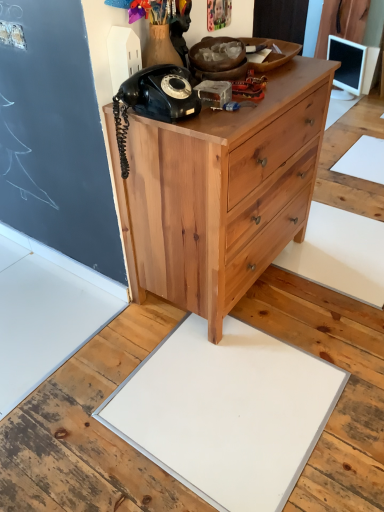
Question: Can you confirm if white glossy monitor at upper right is wider than natural wood chest of drawers at center?

Choices:
 (A) no
 (B) yes

Answer: (A)

Question: Could you tell me if white glossy monitor at upper right is facing natural wood chest of drawers at center?

Choices:
 (A) yes
 (B) no

Answer: (B)

Question: Can you confirm if white glossy monitor at upper right is shorter than natural wood chest of drawers at center?

Choices:
 (A) no
 (B) yes

Answer: (B)

Question: Is white glossy monitor at upper right far away from natural wood chest of drawers at center?

Choices:
 (A) no
 (B) yes

Answer: (B)

Question: Is white glossy monitor at upper right at the left side of natural wood chest of drawers at center?

Choices:
 (A) no
 (B) yes

Answer: (A)

Question: Is white glossy monitor at upper right located outside natural wood chest of drawers at center?

Choices:
 (A) yes
 (B) no

Answer: (A)

Question: Is white matte slate at center closer to camera compared to white glossy monitor at upper right?

Choices:
 (A) yes
 (B) no

Answer: (A)

Question: Is white matte slate at center facing away from white glossy monitor at upper right?

Choices:
 (A) yes
 (B) no

Answer: (B)

Question: Can you confirm if white matte slate at center is positioned to the right of white glossy monitor at upper right?

Choices:
 (A) no
 (B) yes

Answer: (A)

Question: Is white matte slate at center to the left of white glossy monitor at upper right from the viewer's perspective?

Choices:
 (A) yes
 (B) no

Answer: (A)

Question: Can you confirm if white matte slate at center is bigger than white glossy monitor at upper right?

Choices:
 (A) no
 (B) yes

Answer: (B)

Question: From a real-world perspective, is white matte slate at center below white glossy monitor at upper right?

Choices:
 (A) yes
 (B) no

Answer: (A)

Question: Is black matte rotary phone at upper left taller than white glossy monitor at upper right?

Choices:
 (A) yes
 (B) no

Answer: (B)